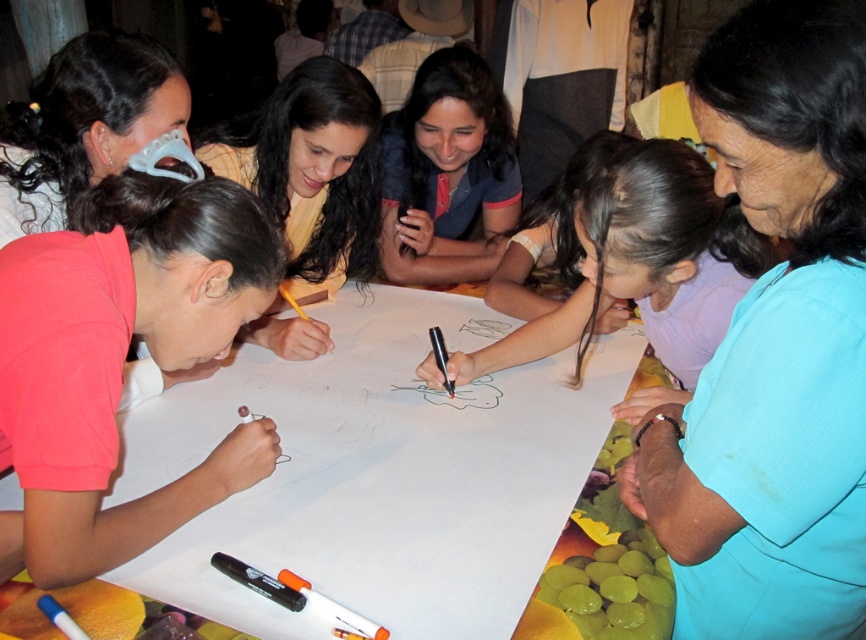
Question: Among these objects, which one is farthest from the camera?

Choices:
 (A) matte pink shirt at lower left
 (B) blue denim shirt at upper center
 (C) light blue shirt at center
 (D) matte plastic mask at upper left

Answer: (B)

Question: Is white paper at center above matte pink shirt at lower left?

Choices:
 (A) yes
 (B) no

Answer: (B)

Question: Which object is farther from the camera taking this photo?

Choices:
 (A) matte pink shirt at lower left
 (B) smooth purple shirt at center
 (C) blue denim shirt at upper center
 (D) matte plastic mask at upper left

Answer: (C)

Question: Can you confirm if blue denim shirt at upper center is wider than black marker at lower center?

Choices:
 (A) no
 (B) yes

Answer: (B)

Question: Which object is farther from the camera taking this photo?

Choices:
 (A) blue denim shirt at upper center
 (B) matte pink shirt at lower left
 (C) black marker at lower center

Answer: (A)

Question: Is matte pink shirt at lower left in front of smooth purple shirt at center?

Choices:
 (A) yes
 (B) no

Answer: (A)